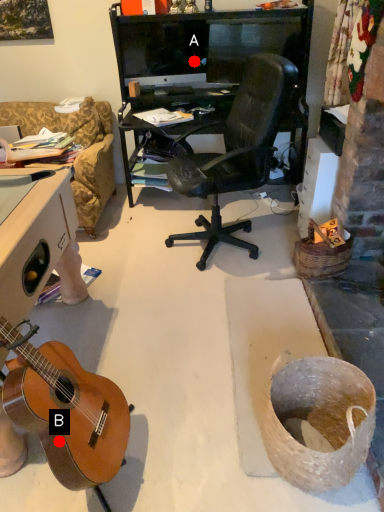
Question: Two points are circled on the image, labeled by A and B beside each circle. Which point is farther to the camera?

Choices:
 (A) A is further
 (B) B is further

Answer: (A)